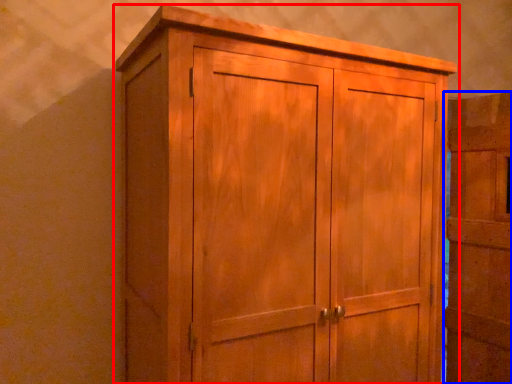
Question: Which object appears farthest to the camera in this image, cupboard (highlighted by a red box) or door (highlighted by a blue box)?

Choices:
 (A) cupboard
 (B) door

Answer: (B)